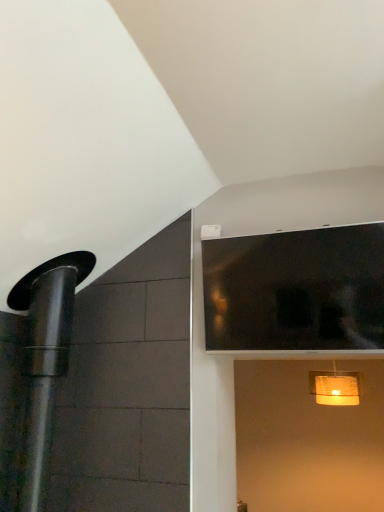
Question: From a real-world perspective, is matte yellow lampshade at lower right above or below black glass window at upper right?

Choices:
 (A) above
 (B) below

Answer: (B)

Question: Considering the positions of matte yellow lampshade at lower right and black glass window at upper right in the image, is matte yellow lampshade at lower right taller or shorter than black glass window at upper right?

Choices:
 (A) tall
 (B) short

Answer: (B)

Question: Would you say matte yellow lampshade at lower right is inside or outside black glass window at upper right?

Choices:
 (A) outside
 (B) inside

Answer: (A)

Question: Looking at the image, does black glass window at upper right seem bigger or smaller compared to matte yellow lampshade at lower right?

Choices:
 (A) big
 (B) small

Answer: (A)

Question: From the image's perspective, is black glass window at upper right above or below matte yellow lampshade at lower right?

Choices:
 (A) above
 (B) below

Answer: (A)

Question: Is black glass window at upper right to the left or to the right of matte yellow lampshade at lower right in the image?

Choices:
 (A) left
 (B) right

Answer: (A)

Question: In terms of height, does black glass window at upper right look taller or shorter compared to matte yellow lampshade at lower right?

Choices:
 (A) tall
 (B) short

Answer: (A)